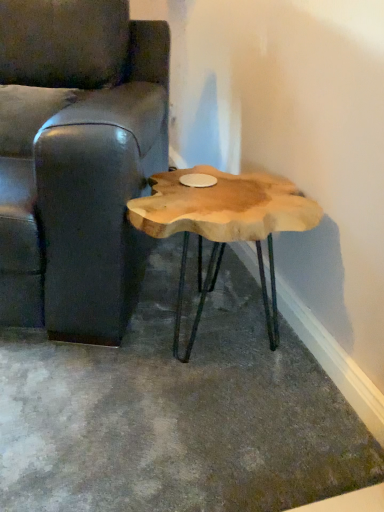
What do you see at coordinates (223, 225) in the screenshot? I see `natural wood coffee table at center` at bounding box center [223, 225].

The image size is (384, 512). I want to click on natural wood coffee table at center, so click(223, 225).

In order to face leather couch at left, should I rotate leftwards or rightwards?

To align with it, rotate left about 21.303°.

What do you see at coordinates (76, 159) in the screenshot? The height and width of the screenshot is (512, 384). I see `leather couch at left` at bounding box center [76, 159].

Locate an element on the screen. This screenshot has height=512, width=384. leather couch at left is located at coordinates (76, 159).

The height and width of the screenshot is (512, 384). In order to click on natural wood coffee table at center in this screenshot , I will do `click(223, 225)`.

Which object is positioned more to the left, leather couch at left or natural wood coffee table at center?

Positioned to the left is leather couch at left.

Based on the photo, is leather couch at left positioned before natural wood coffee table at center?

Yes, leather couch at left is closer to the camera.

Between point (144, 67) and point (154, 212), which one is positioned behind?

The point (144, 67) is more distant.

From the image's perspective, which one is positioned higher, leather couch at left or natural wood coffee table at center?

From the image's view, leather couch at left is above.

From a real-world perspective, which is physically below, leather couch at left or natural wood coffee table at center?

From a 3D spatial view, natural wood coffee table at center is below.

Can you confirm if leather couch at left is thinner than natural wood coffee table at center?

Incorrect, the width of leather couch at left is not less than that of natural wood coffee table at center.

Looking at this image, does leather couch at left have a greater height compared to natural wood coffee table at center?

Yes.

Considering the sizes of objects leather couch at left and natural wood coffee table at center in the image provided, who is smaller, leather couch at left or natural wood coffee table at center?

Smaller between the two is natural wood coffee table at center.

Is natural wood coffee table at center inside leather couch at left?

No, leather couch at left does not contain natural wood coffee table at center.

Can you see leather couch at left touching natural wood coffee table at center?

There is a gap between leather couch at left and natural wood coffee table at center.

Could you tell me if leather couch at left is facing natural wood coffee table at center?

No, leather couch at left does not turn towards natural wood coffee table at center.

This screenshot has width=384, height=512. I want to click on chair above the natural wood coffee table at center (from the image's perspective), so click(x=76, y=159).

Between natural wood coffee table at center and leather couch at left, which one appears on the right side from the viewer's perspective?

natural wood coffee table at center.

Which object is closer to the camera, natural wood coffee table at center or leather couch at left?

leather couch at left is more forward.

Which is behind, point (210, 267) or point (124, 67)?

Point (124, 67)

From the image's perspective, is natural wood coffee table at center located above or below leather couch at left?

Clearly, from the image's perspective, natural wood coffee table at center is below leather couch at left.

From the picture: From a real-world perspective, is natural wood coffee table at center physically located above or below leather couch at left?

Clearly, from a real-world perspective, natural wood coffee table at center is below leather couch at left.

Considering the sizes of objects natural wood coffee table at center and leather couch at left in the image provided, who is thinner, natural wood coffee table at center or leather couch at left?

natural wood coffee table at center.

Considering the relative sizes of natural wood coffee table at center and leather couch at left in the image provided, is natural wood coffee table at center shorter than leather couch at left?

Correct, natural wood coffee table at center is not as tall as leather couch at left.

Which of these two, natural wood coffee table at center or leather couch at left, is smaller?

Smaller between the two is natural wood coffee table at center.

Would you say natural wood coffee table at center is outside leather couch at left?

natural wood coffee table at center is positioned outside leather couch at left.

Is natural wood coffee table at center far from leather couch at left?

natural wood coffee table at center is actually quite close to leather couch at left.

Is natural wood coffee table at center positioned with its back to leather couch at left?

That's not correct — natural wood coffee table at center is not looking away from leather couch at left.

Locate an element on the screen. chair that appears above the natural wood coffee table at center (from the image's perspective) is located at coordinates (76, 159).

Identify the location of coffee table below the leather couch at left (from a real-world perspective). The height and width of the screenshot is (512, 384). (223, 225).

The width and height of the screenshot is (384, 512). In order to click on coffee table on the right of leather couch at left in this screenshot , I will do `click(223, 225)`.